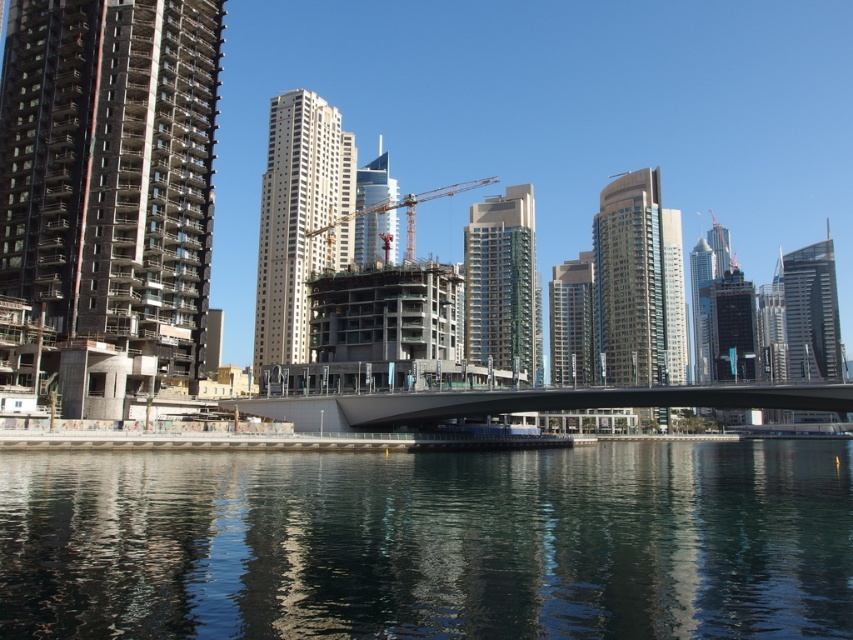
Question: Which object is positioned closest to the beige glass building at center?

Choices:
 (A) white glass skyscraper at center
 (B) glassy concrete skyscraper at center
 (C) concrete/brick building at left

Answer: (B)

Question: Is dark reflective water at center below glassy steel skyscraper at right?

Choices:
 (A) no
 (B) yes

Answer: (B)

Question: Which point appears farthest from the camera in this image?

Choices:
 (A) (828, 342)
 (B) (366, 188)

Answer: (A)

Question: Which point is closer to the camera?

Choices:
 (A) glassy concrete skyscraper at center
 (B) dark reflective water at center
 (C) metallic construction crane at center

Answer: (B)

Question: Is dark reflective water at center behind metallic construction crane at center?

Choices:
 (A) yes
 (B) no

Answer: (B)

Question: Does beige glass building at center appear over smooth concrete bridge at center?

Choices:
 (A) no
 (B) yes

Answer: (B)